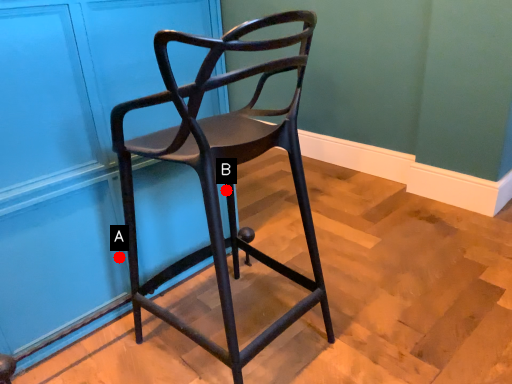
Question: Two points are circled on the image, labeled by A and B beside each circle. Among these points, which one is farthest from the camera?

Choices:
 (A) A is further
 (B) B is further

Answer: (B)